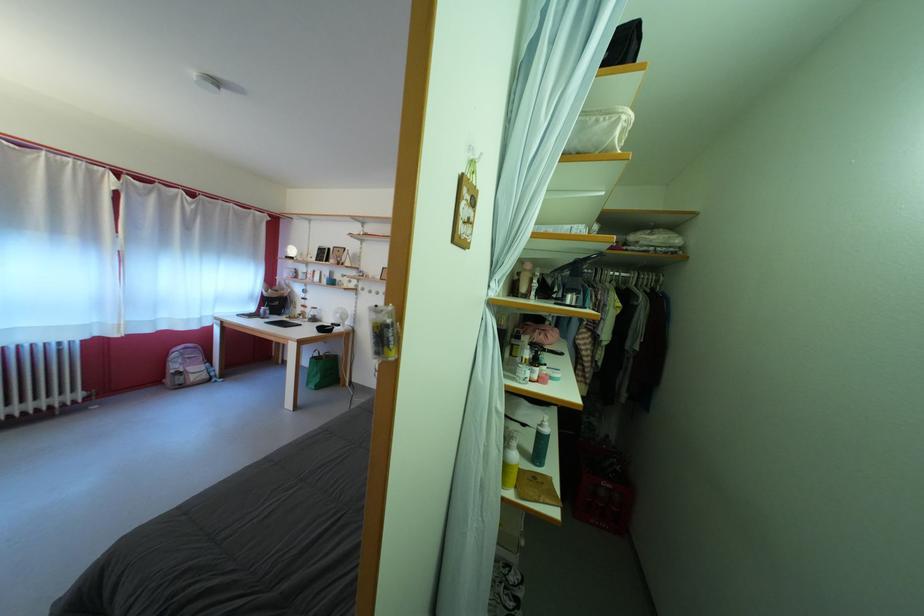
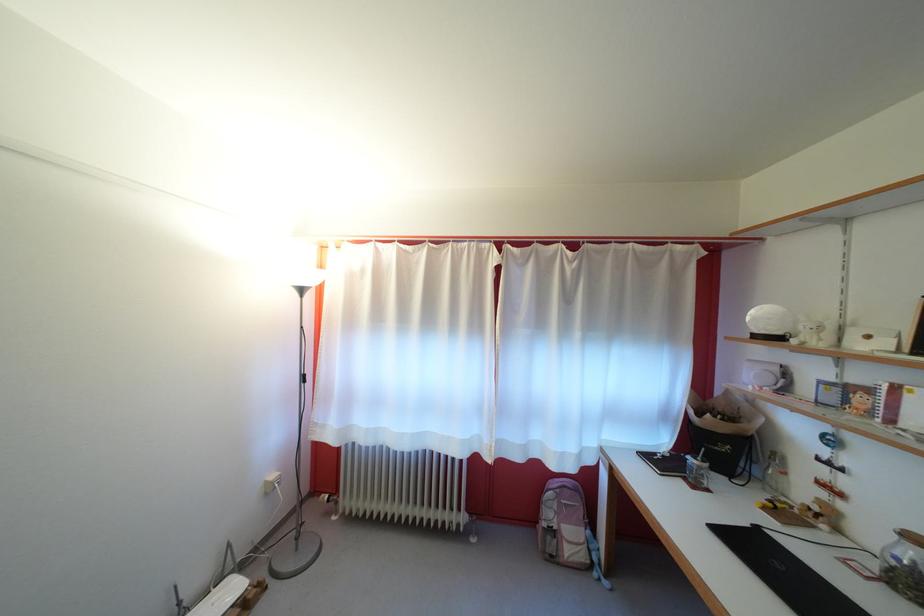
Where in the second image is the point corresponding to [184,373] from the first image?

(556, 521)